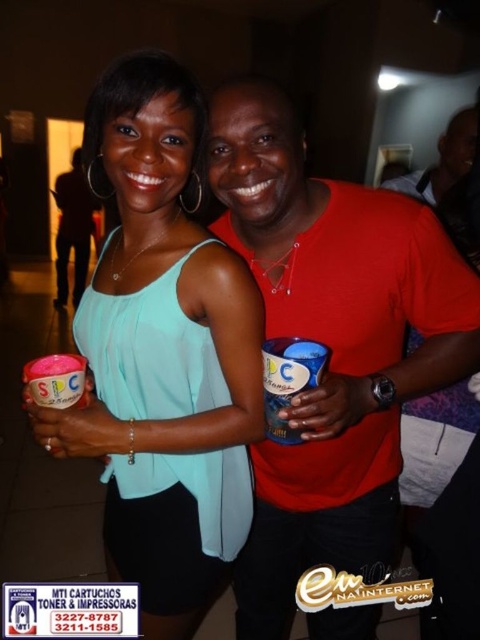
Does blue plastic cup at center have a greater width compared to pink matte cup at center?

No.

Is blue plastic cup at center below pink matte cup at center?

No, blue plastic cup at center is not below pink matte cup at center.

Is point (288, 368) less distant than point (25, 372)?

Yes, point (288, 368) is closer to viewer.

This screenshot has height=640, width=480. What are the coordinates of `blue plastic cup at center` in the screenshot? It's located at (288, 380).

Between matte black shirt at center and matte red shirt at upper right, which one has more height?

Standing taller between the two is matte black shirt at center.

Is matte black shirt at center thinner than matte red shirt at upper right?

No, matte black shirt at center is not thinner than matte red shirt at upper right.

Consider the image. Who is more distant from viewer, (64, 172) or (470, 148)?

The point (64, 172) is more distant.

Find the location of `matte black shirt at center`. matte black shirt at center is located at coordinates (72, 228).

Does matte teal blouse at center have a greater height compared to matte black shirt at center?

No.

Between point (146, 637) and point (59, 275), which one is positioned in front?

Point (146, 637) is in front.

Locate an element on the screen. The height and width of the screenshot is (640, 480). matte teal blouse at center is located at coordinates (164, 355).